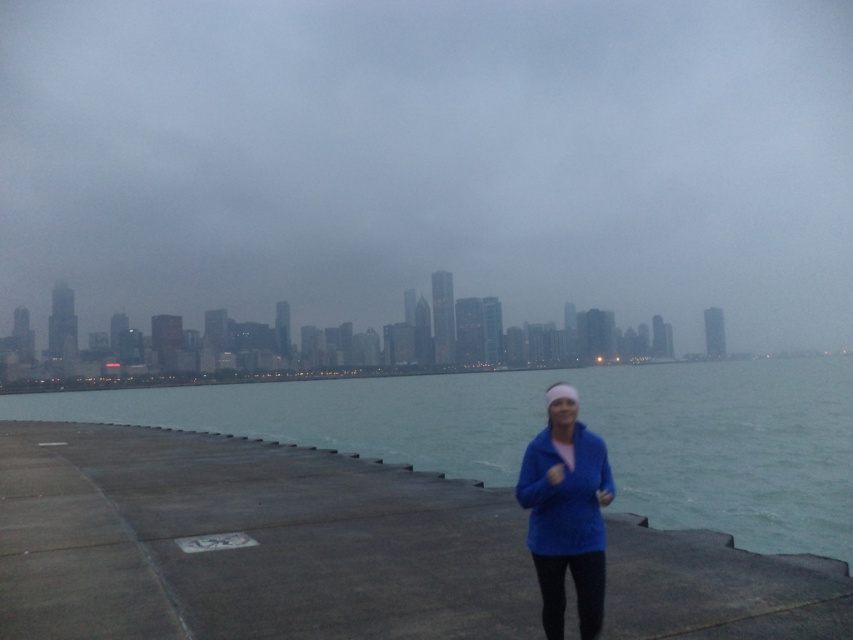
What do you see at coordinates (579, 417) in the screenshot? I see `greenish-blue water at center` at bounding box center [579, 417].

Is greenish-blue water at center above blue fleece jacket at lower right?

Actually, greenish-blue water at center is below blue fleece jacket at lower right.

Is point (813, 524) behind point (595, 440)?

Yes, it is behind point (595, 440).

This screenshot has width=853, height=640. In order to click on greenish-blue water at center in this screenshot , I will do `click(579, 417)`.

Is foggy skyline at center thinner than greenish-blue water at center?

In fact, foggy skyline at center might be wider than greenish-blue water at center.

Can you confirm if foggy skyline at center is bigger than greenish-blue water at center?

Yes, foggy skyline at center is bigger than greenish-blue water at center.

Describe the element at coordinates (432, 160) in the screenshot. I see `foggy skyline at center` at that location.

This screenshot has width=853, height=640. What are the coordinates of `foggy skyline at center` in the screenshot? It's located at (432, 160).

Can you confirm if foggy skyline at center is taller than blue fleece jacket at lower right?

Indeed, foggy skyline at center has a greater height compared to blue fleece jacket at lower right.

Is point (840, 228) positioned in front of point (595, 449)?

That is False.

This screenshot has width=853, height=640. In order to click on foggy skyline at center in this screenshot , I will do `click(432, 160)`.